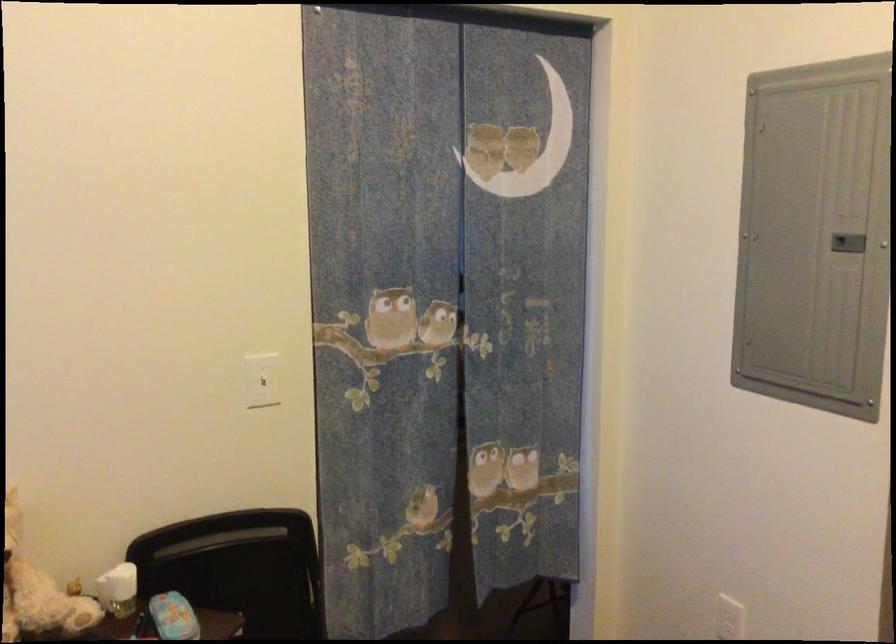
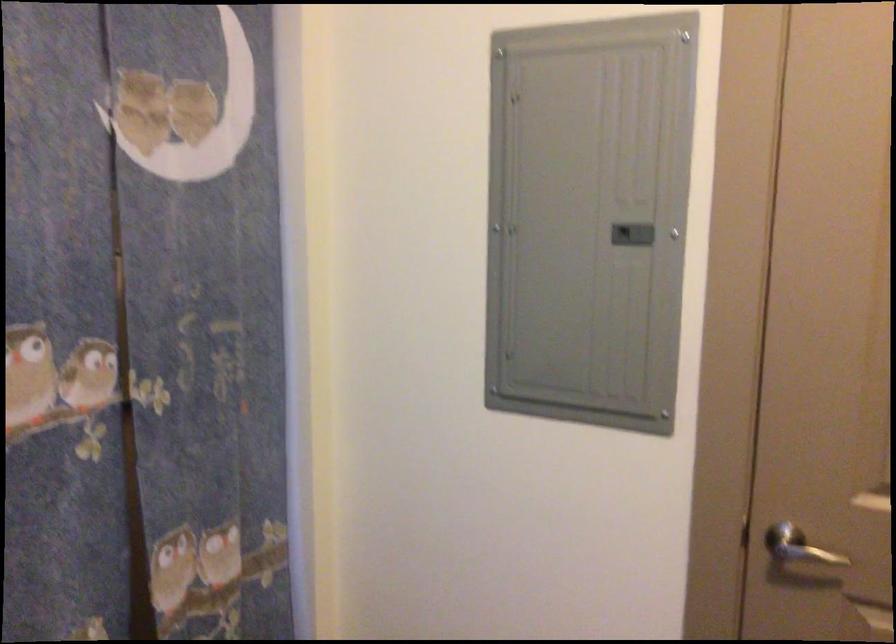
Question: How did the camera likely rotate?

Choices:
 (A) Left
 (B) Right
 (C) Up
 (D) Down

Answer: (B)